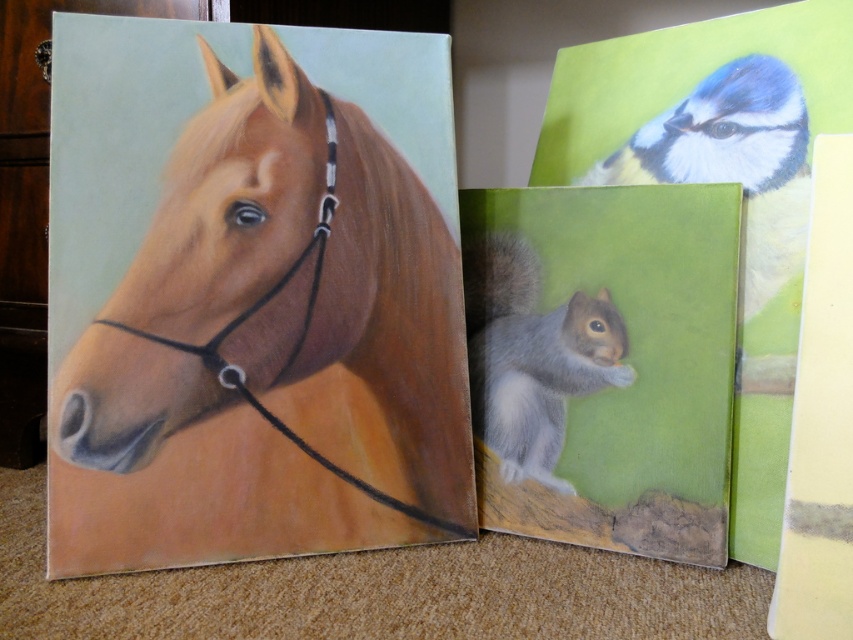
You are an art curator arranging these paintings in a gallery. The middle painting has a gray furry squirrel at center and a satin black bridle at left. Which object in the middle painting is taller?

The satin black bridle at left is taller than the gray furry squirrel at center in the middle painting.

What is the height relationship between the matte brown horse at left and the satin black bridle at left in the leftmost painting?

The matte brown horse at left is much taller than the satin black bridle at left.

You are standing in front of the three paintings displayed on the carpeted floor. You notice two points marked on the middle painting. The first point is at coordinates point (131, 392) and the second point is at point (268, 291). Which of these two points is closer to you?

Point (131, 392) is closer to the camera than point (268, 291).